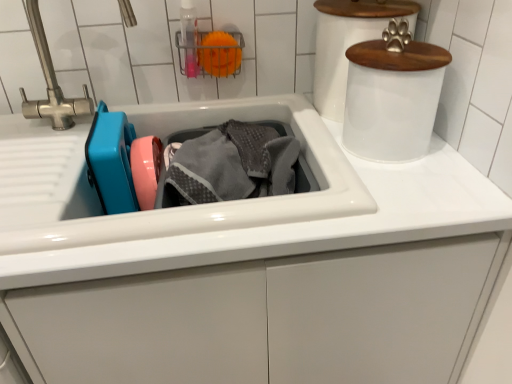
You are a GUI agent. You are given a task and a screenshot of the screen. Output one action in this format:
    pyautogui.click(x=<x>, y=<y>)
    Task: Click on the transparent plastic bottle at upper center
    The width and height of the screenshot is (512, 384).
    Given the screenshot: What is the action you would take?
    pyautogui.click(x=189, y=37)

Is transparent plastic bottle at upper center outside of white glossy sink at center?

Absolutely, transparent plastic bottle at upper center is external to white glossy sink at center.

From the image's perspective, between transparent plastic bottle at upper center and white glossy sink at center, which one is located above?

transparent plastic bottle at upper center is shown above in the image.

Based on the photo, between transparent plastic bottle at upper center and white glossy sink at center, which one has smaller size?

transparent plastic bottle at upper center is smaller.

Which is in front, point (186, 9) or point (309, 194)?

Point (309, 194)

Which is further, (280, 165) or (396, 112)?

Positioned behind is point (280, 165).

Who is shorter, gray terry towel at center or white frosted plastic canister at upper right, the first appliance from the front?

gray terry towel at center.

Could you tell me if gray terry towel at center is facing white frosted plastic canister at upper right, which ranks as the second appliance in back-to-front order?

No, gray terry towel at center does not turn towards white frosted plastic canister at upper right, which ranks as the second appliance in back-to-front order.

Is gray terry towel at center surrounding white frosted plastic canister at upper right, the first appliance from the front?

No, white frosted plastic canister at upper right, the first appliance from the front, is not surrounded by gray terry towel at center.

Looking at this image, from the image's perspective, which is above, white glossy sink at center or transparent plastic bottle at upper center?

transparent plastic bottle at upper center.

This screenshot has height=384, width=512. I want to click on bottle above the white glossy sink at center (from the image's perspective), so click(189, 37).

Between white glossy sink at center and transparent plastic bottle at upper center, which one has more height?

transparent plastic bottle at upper center is taller.

Is transparent plastic bottle at upper center a part of white glossy sink at center?

No, transparent plastic bottle at upper center is located outside of white glossy sink at center.

Does white glossy paw print at upper right, placed as the 1th appliance when sorted from back to front, lie in front of white frosted plastic canister at upper right, which ranks as the second appliance in back-to-front order?

No.

In the scene shown: Considering the relative sizes of white glossy paw print at upper right, which ranks as the 2th appliance in front-to-back order, and white frosted plastic canister at upper right, the first appliance from the front, in the image provided, is white glossy paw print at upper right, which ranks as the 2th appliance in front-to-back order, bigger than white frosted plastic canister at upper right, the first appliance from the front,?

Indeed, white glossy paw print at upper right, which ranks as the 2th appliance in front-to-back order, has a larger size compared to white frosted plastic canister at upper right, the first appliance from the front.

Is white frosted plastic canister at upper right, the first appliance from the front, located within white glossy paw print at upper right, which ranks as the 2th appliance in front-to-back order?

Definitely not — white frosted plastic canister at upper right, the first appliance from the front, is not inside white glossy paw print at upper right, which ranks as the 2th appliance in front-to-back order.

Considering the sizes of white glossy paw print at upper right, placed as the 1th appliance when sorted from back to front, and white frosted plastic canister at upper right, which ranks as the second appliance in back-to-front order, in the image, is white glossy paw print at upper right, placed as the 1th appliance when sorted from back to front, taller or shorter than white frosted plastic canister at upper right, which ranks as the second appliance in back-to-front order,?

Clearly, white glossy paw print at upper right, placed as the 1th appliance when sorted from back to front, is taller compared to white frosted plastic canister at upper right, which ranks as the second appliance in back-to-front order.

Is point (393, 149) closer to viewer compared to point (187, 13)?

Yes, point (393, 149) is closer to viewer.

Is white frosted plastic canister at upper right, the first appliance from the front, turned away from transparent plastic bottle at upper center?

No, white frosted plastic canister at upper right, the first appliance from the front, is not facing away from transparent plastic bottle at upper center.

Is white frosted plastic canister at upper right, the first appliance from the front, positioned before transparent plastic bottle at upper center?

Yes, the depth of white frosted plastic canister at upper right, the first appliance from the front, is less than that of transparent plastic bottle at upper center.

Can you tell me how much white glossy sink at center and white glossy paw print at upper right, placed as the 1th appliance when sorted from back to front, differ in facing direction?

white glossy sink at center and white glossy paw print at upper right, placed as the 1th appliance when sorted from back to front, are facing 0.155 degrees away from each other.

Identify the location of sink on the left of white glossy paw print at upper right, placed as the 1th appliance when sorted from back to front. (220, 203).

Is white glossy sink at center positioned with its back to white glossy paw print at upper right, which ranks as the 2th appliance in front-to-back order?

No, white glossy sink at center is not facing away from white glossy paw print at upper right, which ranks as the 2th appliance in front-to-back order.

Which of these two, white glossy sink at center or white glossy paw print at upper right, placed as the 1th appliance when sorted from back to front, stands shorter?

With less height is white glossy sink at center.

Is white frosted plastic canister at upper right, which ranks as the second appliance in back-to-front order, smaller than white glossy paw print at upper right, which ranks as the 2th appliance in front-to-back order?

Correct, white frosted plastic canister at upper right, which ranks as the second appliance in back-to-front order, occupies less space than white glossy paw print at upper right, which ranks as the 2th appliance in front-to-back order.

Is white frosted plastic canister at upper right, which ranks as the second appliance in back-to-front order, aimed at white glossy paw print at upper right, which ranks as the 2th appliance in front-to-back order?

No, white frosted plastic canister at upper right, which ranks as the second appliance in back-to-front order, is not oriented towards white glossy paw print at upper right, which ranks as the 2th appliance in front-to-back order.

Is white frosted plastic canister at upper right, the first appliance from the front, inside or outside of white glossy paw print at upper right, which ranks as the 2th appliance in front-to-back order?

white frosted plastic canister at upper right, the first appliance from the front, exists outside the volume of white glossy paw print at upper right, which ranks as the 2th appliance in front-to-back order.

Where is `sink directly beneath the transparent plastic bottle at upper center (from a real-world perspective)`? sink directly beneath the transparent plastic bottle at upper center (from a real-world perspective) is located at coordinates (220, 203).

The height and width of the screenshot is (384, 512). Identify the location of material on the left of white frosted plastic canister at upper right, the first appliance from the front. (232, 165).

From the picture: Which object lies nearer to the anchor point transparent plastic bottle at upper center, white frosted plastic canister at upper right, the first appliance from the front, or white glossy sink at center?

Based on the image, white glossy sink at center appears to be nearer to transparent plastic bottle at upper center.

From the picture: Considering their positions, is white frosted plastic canister at upper right, which ranks as the second appliance in back-to-front order, positioned closer to white glossy paw print at upper right, which ranks as the 2th appliance in front-to-back order, than transparent plastic bottle at upper center?

The object closer to white glossy paw print at upper right, which ranks as the 2th appliance in front-to-back order, is white frosted plastic canister at upper right, which ranks as the second appliance in back-to-front order.

Considering their positions, is gray terry towel at center positioned closer to white glossy sink at center than white frosted plastic canister at upper right, the first appliance from the front?

Among the two, gray terry towel at center is located nearer to white glossy sink at center.

Considering their positions, is white frosted plastic canister at upper right, the first appliance from the front, positioned further to gray terry towel at center than white glossy sink at center?

white frosted plastic canister at upper right, the first appliance from the front, lies further to gray terry towel at center than the other object.

Based on their spatial positions, is gray terry towel at center or white frosted plastic canister at upper right, the first appliance from the front, closer to white glossy paw print at upper right, which ranks as the 2th appliance in front-to-back order?

white frosted plastic canister at upper right, the first appliance from the front, is positioned closer to the anchor white glossy paw print at upper right, which ranks as the 2th appliance in front-to-back order.

From the picture: Based on their spatial positions, is white glossy paw print at upper right, placed as the 1th appliance when sorted from back to front, or gray terry towel at center closer to white frosted plastic canister at upper right, which ranks as the second appliance in back-to-front order?

Among the two, white glossy paw print at upper right, placed as the 1th appliance when sorted from back to front, is located nearer to white frosted plastic canister at upper right, which ranks as the second appliance in back-to-front order.

Looking at the image, which one is located closer to gray terry towel at center, white glossy paw print at upper right, placed as the 1th appliance when sorted from back to front, or white frosted plastic canister at upper right, which ranks as the second appliance in back-to-front order?

Among the two, white frosted plastic canister at upper right, which ranks as the second appliance in back-to-front order, is located nearer to gray terry towel at center.

When comparing their distances from white glossy paw print at upper right, placed as the 1th appliance when sorted from back to front, does transparent plastic bottle at upper center or white glossy sink at center seem further?

transparent plastic bottle at upper center.

Locate an element on the screen. The width and height of the screenshot is (512, 384). appliance located between gray terry towel at center and white frosted plastic canister at upper right, which ranks as the second appliance in back-to-front order, in the left-right direction is located at coordinates (348, 43).

You are a GUI agent. You are given a task and a screenshot of the screen. Output one action in this format:
    pyautogui.click(x=<x>, y=<y>)
    Task: Click on the material located between transparent plastic bottle at upper center and white frosted plastic canister at upper right, which ranks as the second appliance in back-to-front order, in the left-right direction
    This screenshot has width=512, height=384.
    Given the screenshot: What is the action you would take?
    pyautogui.click(x=232, y=165)

This screenshot has height=384, width=512. What are the coordinates of `bottle situated between white glossy sink at center and white frosted plastic canister at upper right, the first appliance from the front, from left to right` in the screenshot? It's located at (189, 37).

This screenshot has height=384, width=512. I want to click on material between transparent plastic bottle at upper center and white glossy sink at center vertically, so click(232, 165).